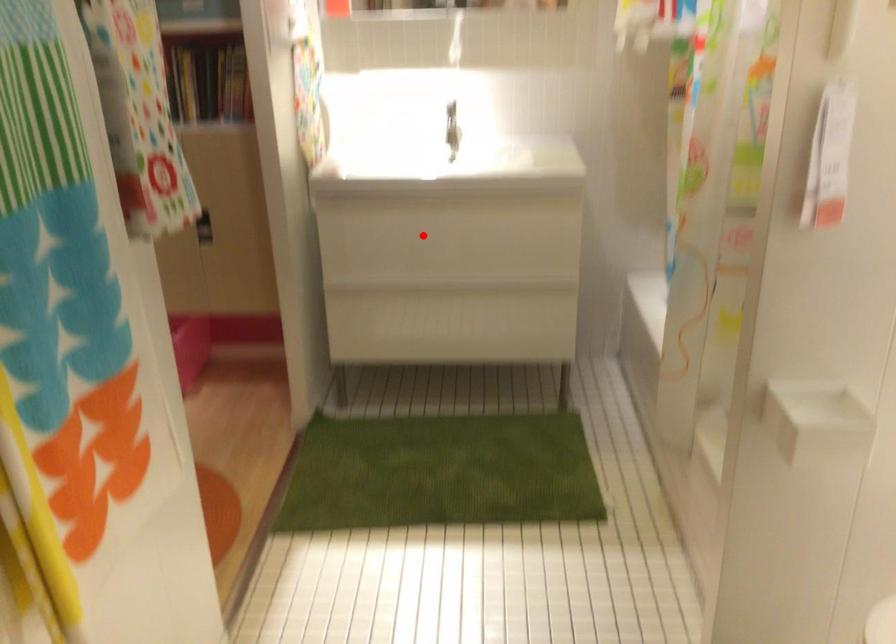
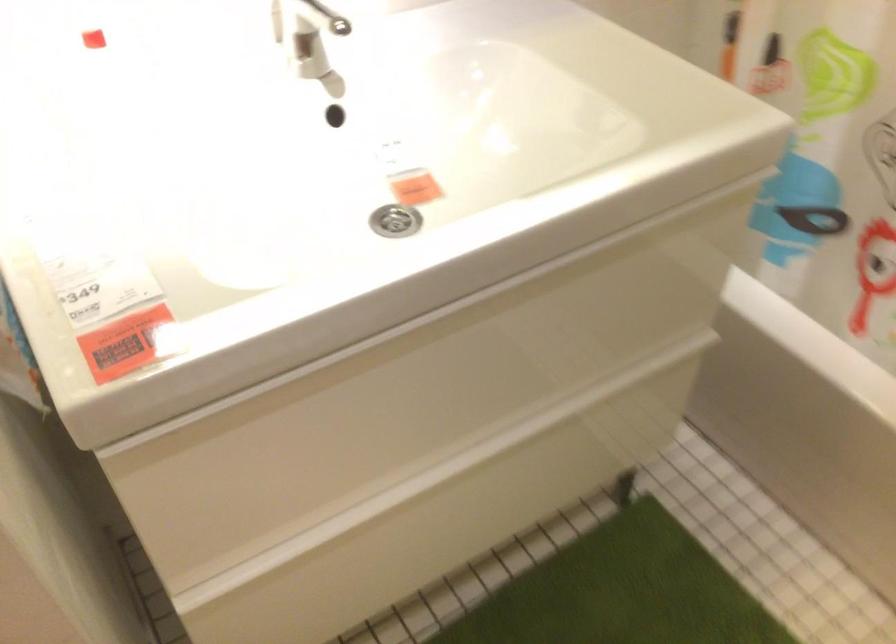
Question: I am providing you with two images of the same scene from different viewpoints. Given a red point in image1, look at the same physical point in image2. Is it:

Choices:
 (A) Closer to the viewpoint
 (B) Farther from the viewpoint

Answer: (A)